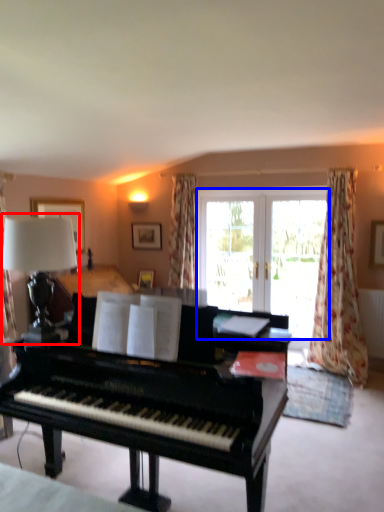
Question: Which object appears farthest to the camera in this image, table lamp (highlighted by a red box) or bay window (highlighted by a blue box)?

Choices:
 (A) table lamp
 (B) bay window

Answer: (B)